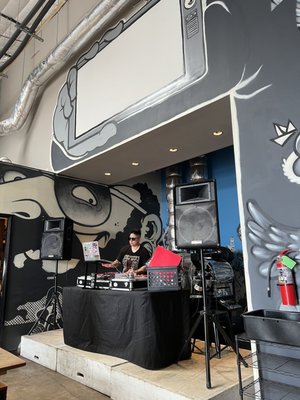
You are a GUI agent. You are given a task and a screenshot of the screen. Output one action in this format:
    pyautogui.click(x=<x>, y=<y>)
    Task: Click on the extinguisher
    The height and width of the screenshot is (400, 300).
    Given the screenshot: What is the action you would take?
    pyautogui.click(x=290, y=288)